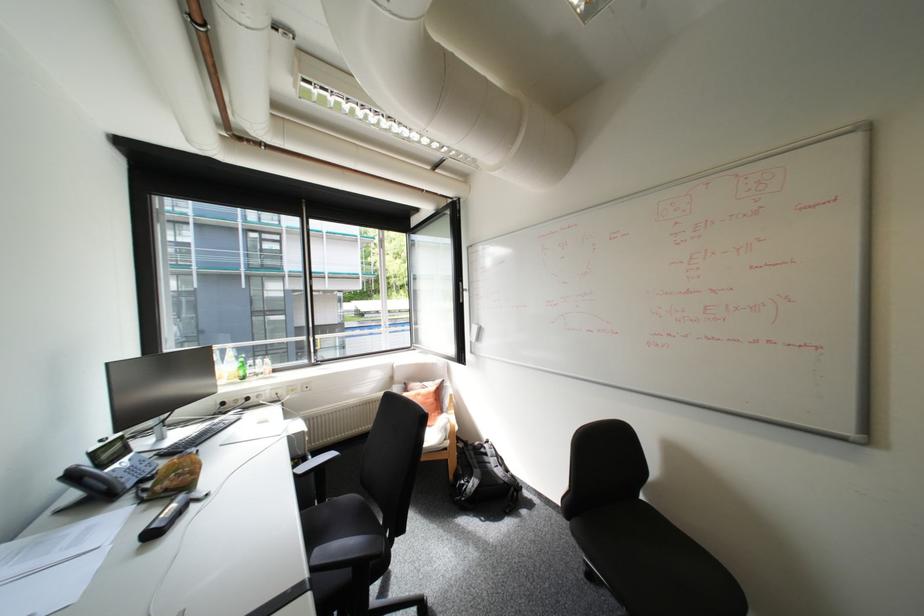
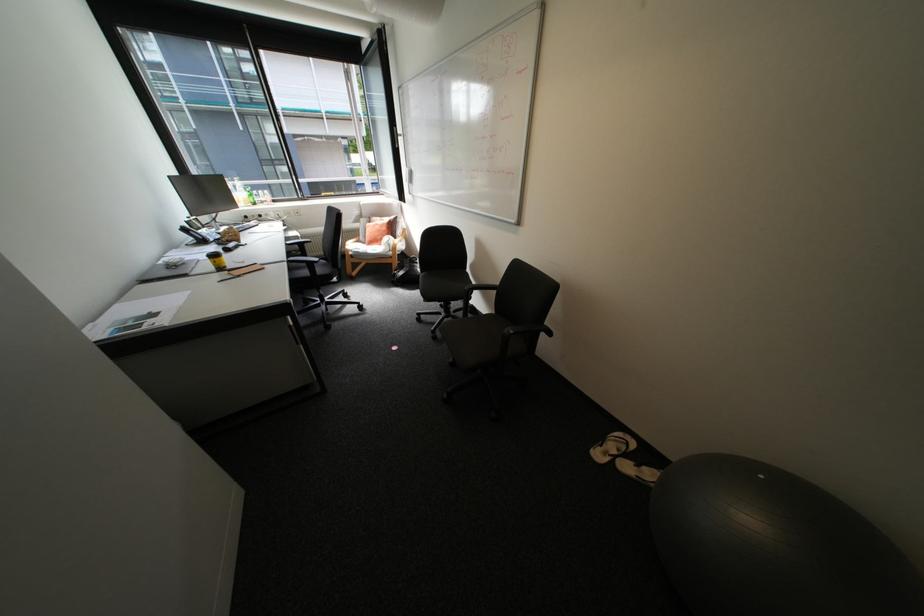
Locate, in the second image, the point that corresponds to pixel 239 379 in the first image.

(256, 204)